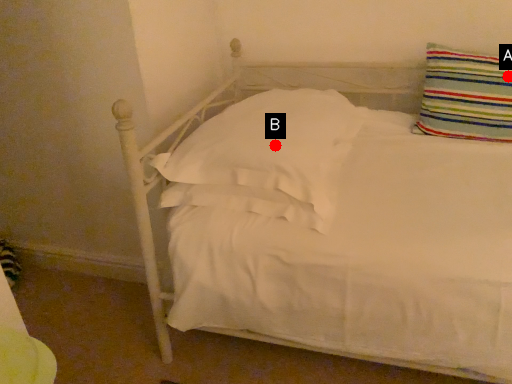
Question: Two points are circled on the image, labeled by A and B beside each circle. Which of the following is the farthest from the observer?

Choices:
 (A) A is further
 (B) B is further

Answer: (A)